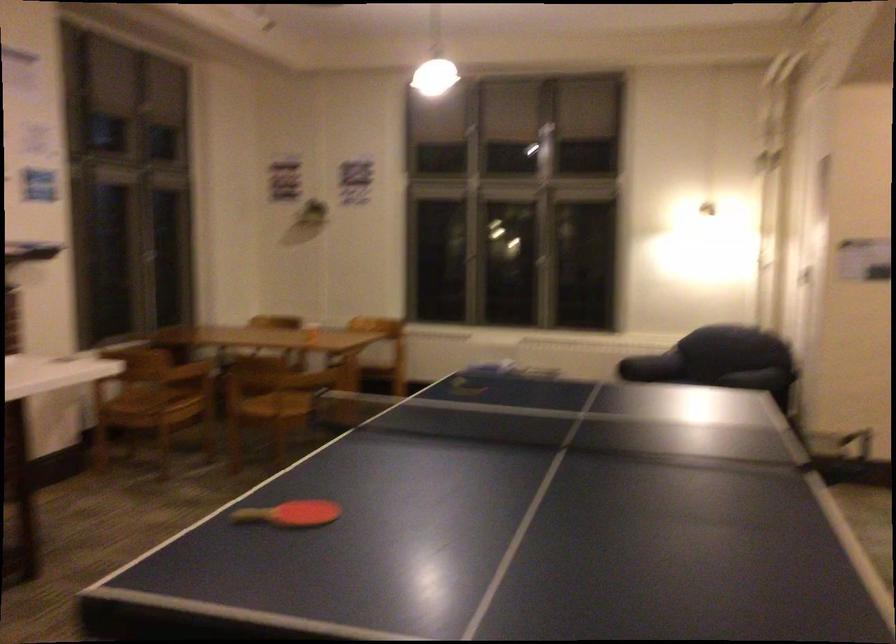
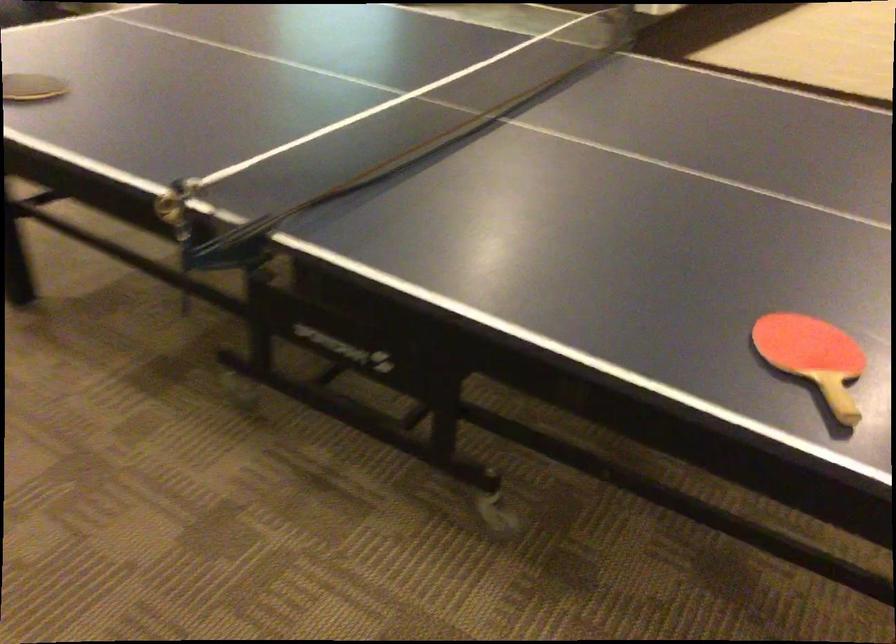
Locate, in the second image, the point that corresponds to [246,513] in the first image.

(813, 357)